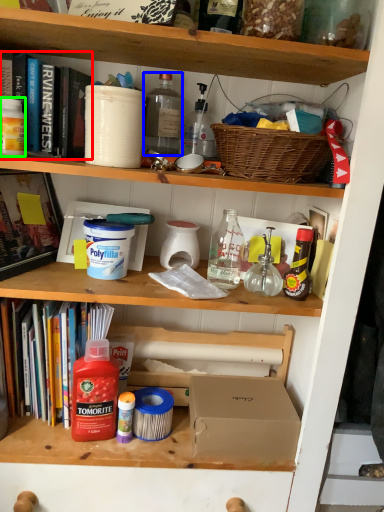
Question: Based on their relative distances, which object is farther from book (highlighted by a red box)? Choose from bottle (highlighted by a blue box) and bucket (highlighted by a green box).

Choices:
 (A) bottle
 (B) bucket

Answer: (A)